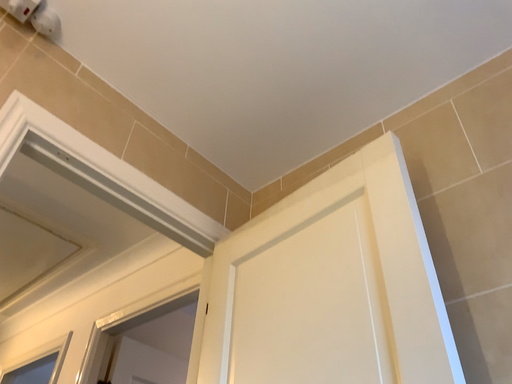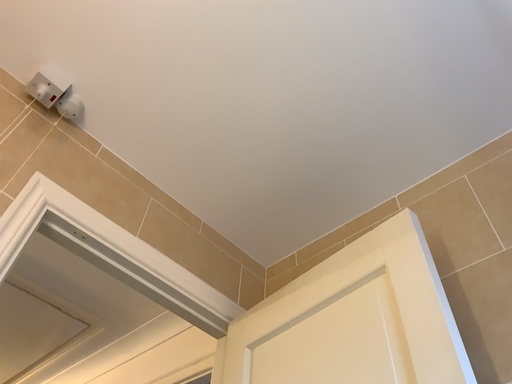
Question: How did the camera likely rotate when shooting the video?

Choices:
 (A) rotated downward
 (B) rotated upward

Answer: (B)